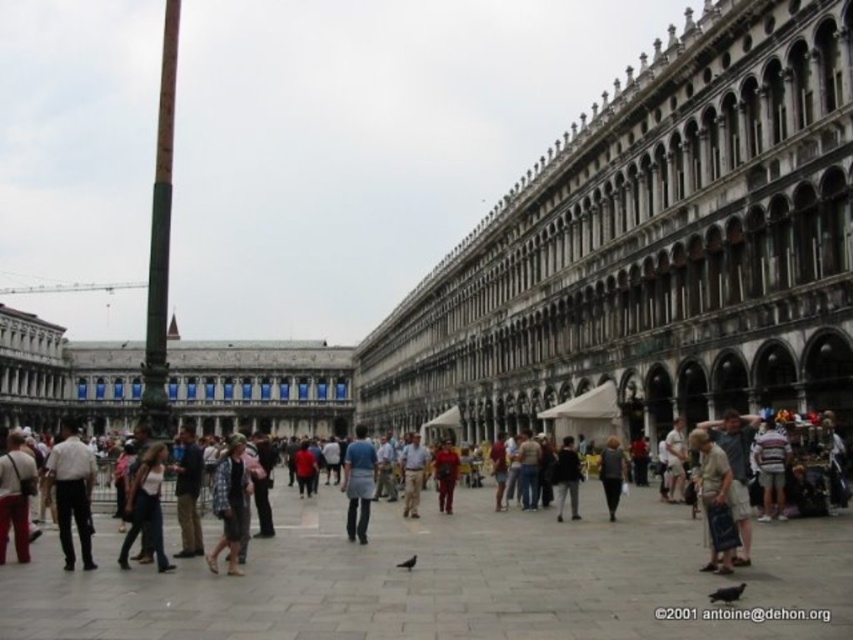
Question: Does stone arches at center appear over blue denim jeans at center?

Choices:
 (A) yes
 (B) no

Answer: (A)

Question: Is stone arches at center bigger than blue denim jeans at center?

Choices:
 (A) no
 (B) yes

Answer: (B)

Question: Which point appears farthest from the camera in this image?

Choices:
 (A) (372, 451)
 (B) (567, 340)

Answer: (B)

Question: Can you confirm if stone arches at center is bigger than blue denim jeans at center?

Choices:
 (A) yes
 (B) no

Answer: (A)